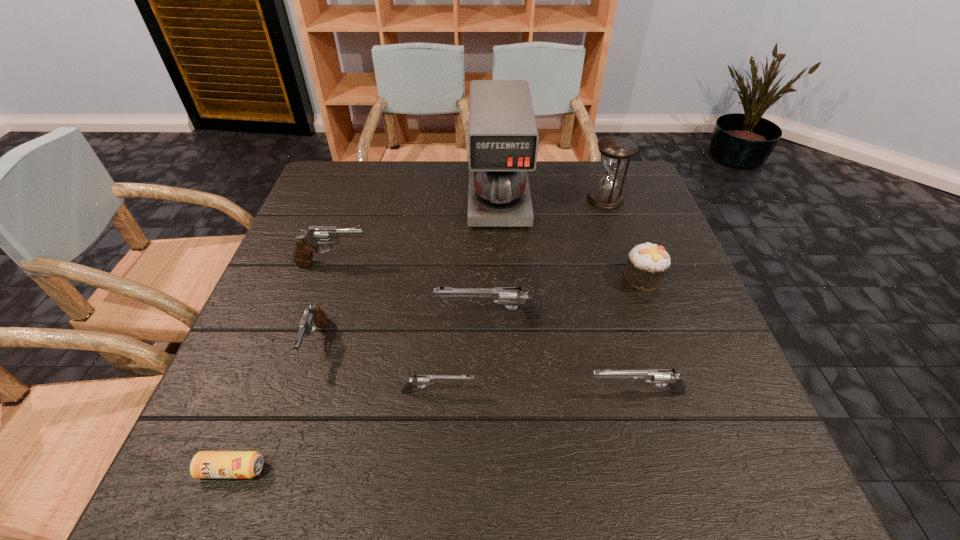
Locate an element on the screen. object that stands as the seventh closest to the tallest pistol is located at coordinates (647, 263).

The width and height of the screenshot is (960, 540). I want to click on object identified as the closest to the tallest object, so click(616, 150).

Locate an element on the screen. The width and height of the screenshot is (960, 540). the second closest pistol to the eighth shortest object is located at coordinates coord(668,377).

Identify which pistol is the fourth nearest to the smallest silver pistol. Please provide its 2D coordinates. Your answer should be formatted as a tuple, i.e. [(x, y)], where the tuple contains the x and y coordinates of a point satisfying the conditions above.

[(307, 244)]

You are a GUI agent. You are given a task and a screenshot of the screen. Output one action in this format:
    pyautogui.click(x=<x>, y=<y>)
    Task: Click on the silver pistol that is the nearest to the coffee maker
    This screenshot has width=960, height=540.
    Given the screenshot: What is the action you would take?
    pyautogui.click(x=514, y=295)

You are a GUI agent. You are given a task and a screenshot of the screen. Output one action in this format:
    pyautogui.click(x=<x>, y=<y>)
    Task: Click on the silver pistol that stands as the second closest to the second biggest silver pistol
    This screenshot has height=540, width=960.
    Given the screenshot: What is the action you would take?
    pyautogui.click(x=424, y=380)

I want to click on free space in the image that satisfies the following two spatial constraints: 1. on the carafe side of the coffee maker; 2. on the front-facing side of the shortest pistol, so click(x=509, y=392).

Identify the location of vacant region that satisfies the following two spatial constraints: 1. on the front side of the hourglass; 2. on the front-facing side of the eighth tallest object. (672, 392).

Identify the location of blank space that satisfies the following two spatial constraints: 1. on the front-facing side of the biggest silver pistol; 2. at the barrel of the smaller gray pistol. This screenshot has height=540, width=960. (489, 342).

Find the location of a particular element. Image resolution: width=960 pixels, height=540 pixels. vacant space that satisfies the following two spatial constraints: 1. on the carafe side of the tallest object; 2. on the right side of the hourglass is located at coordinates (498, 199).